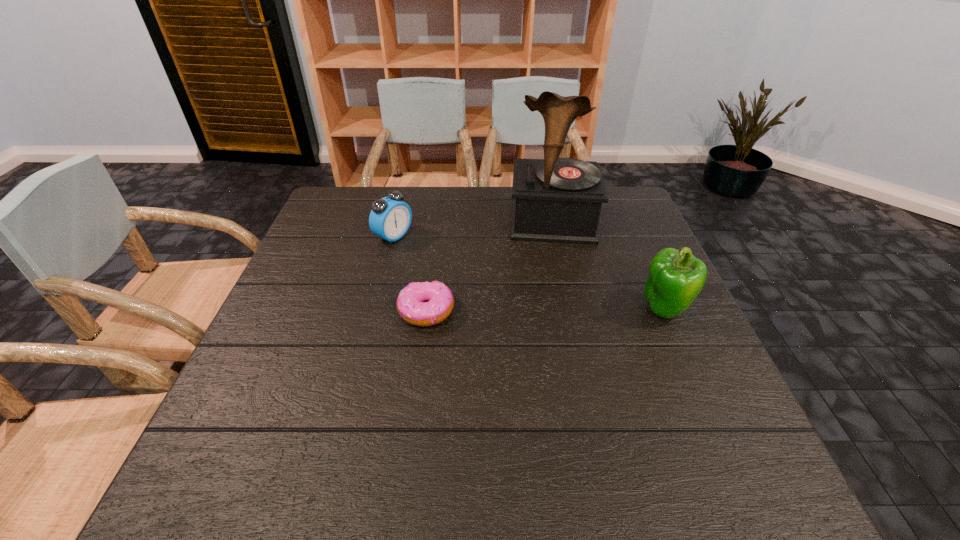
I want to click on vacant space on the desktop that is between the doughnut and the rightmost object and is positioned on the face of the second shortest object, so click(537, 310).

Identify the location of vacant spot on the desktop that is between the doughnut and the bell pepper and is positioned at the horn opening of the second object from right to left. (558, 309).